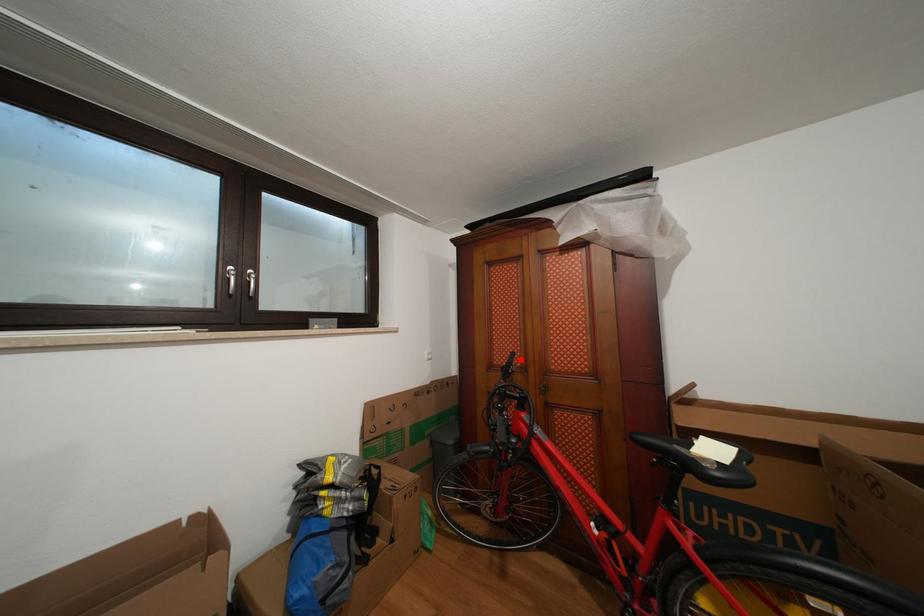
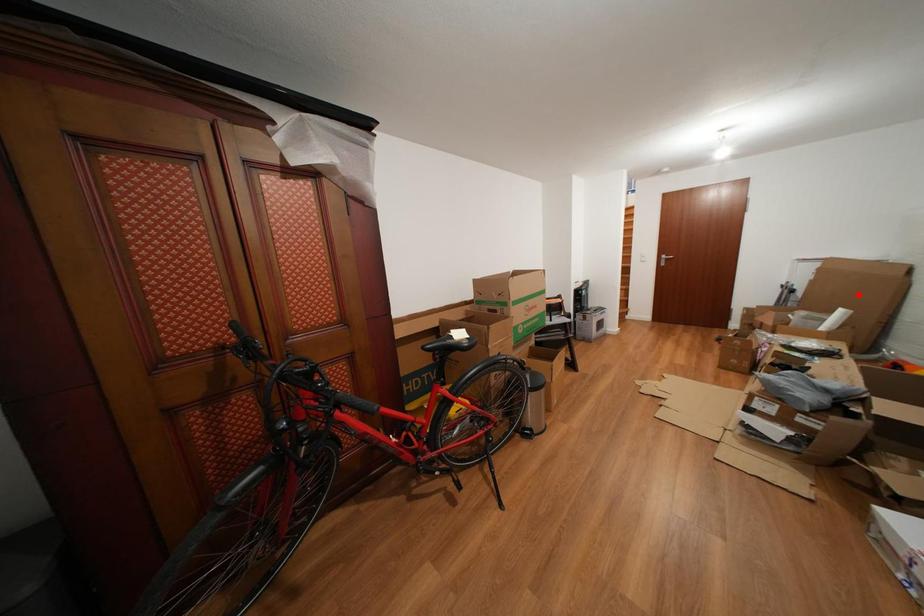
I am providing you with two images of the same scene from different viewpoints. A red point is marked on the first image and another point is marked on the second image. Do the highlighted points in image1 and image2 indicate the same real-world spot?

No